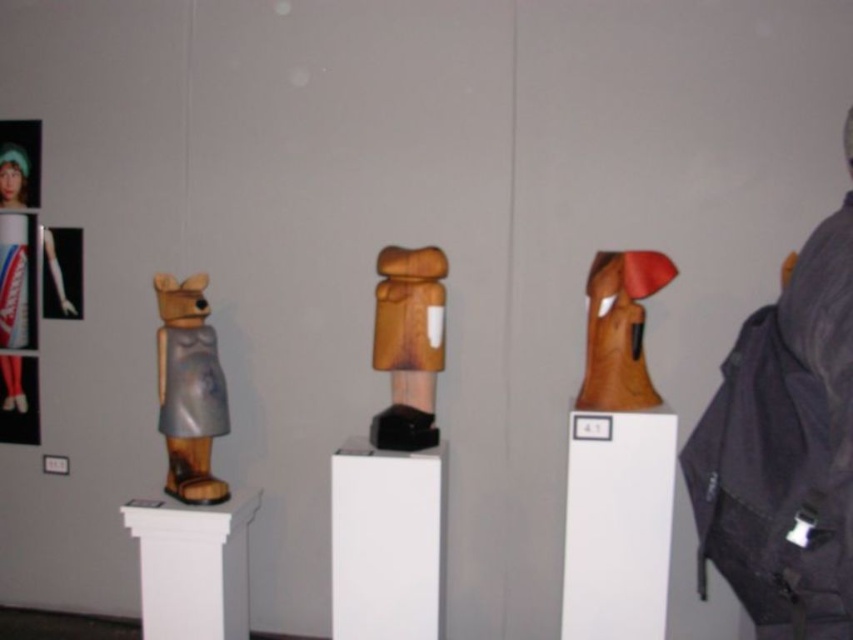
Question: Which point is farther from the camera taking this photo?

Choices:
 (A) (750, 355)
 (B) (190, 323)

Answer: (B)

Question: Is dark gray fabric backpack at right positioned at the back of wooden bear at left?

Choices:
 (A) yes
 (B) no

Answer: (B)

Question: Which object is the closest to the wooden bear at left?

Choices:
 (A) metallic silver dress at left
 (B) wooden statue at center
 (C) wooden sculpture at right
 (D) dark gray fabric backpack at right

Answer: (B)

Question: Does dark gray fabric backpack at right appear on the right side of metallic silver dress at left?

Choices:
 (A) no
 (B) yes

Answer: (B)

Question: Which object appears farthest from the camera in this image?

Choices:
 (A) wooden bear at left
 (B) wooden statue at center

Answer: (A)

Question: Is dark gray fabric backpack at right bigger than wooden statue at center?

Choices:
 (A) yes
 (B) no

Answer: (A)